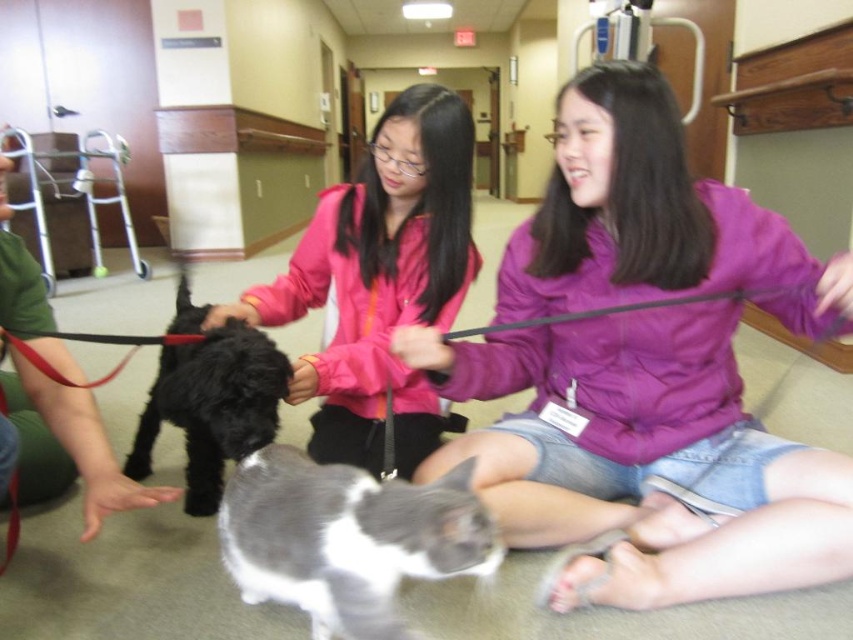
Consider the image. Who is positioned more to the right, gray-white fur cat at lower center or black matte dog at center?

Positioned to the right is gray-white fur cat at lower center.

Which of these two, gray-white fur cat at lower center or black matte dog at center, stands taller?

black matte dog at center

Where is `gray-white fur cat at lower center`? gray-white fur cat at lower center is located at coordinates (347, 538).

Which is above, purple satin jacket at center or gray-white fur cat at lower center?

purple satin jacket at center is higher up.

Does point (786, 524) lie in front of point (412, 492)?

No, (786, 524) is behind (412, 492).

Between point (796, 490) and point (306, 524), which one is positioned in front?

Positioned in front is point (306, 524).

Where is `purple satin jacket at center`? This screenshot has width=853, height=640. purple satin jacket at center is located at coordinates (641, 458).

Between matte pink jacket at center and gray-white fur cat at lower center, which one has more height?

matte pink jacket at center is taller.

You are a GUI agent. You are given a task and a screenshot of the screen. Output one action in this format:
    pyautogui.click(x=<x>, y=<y>)
    Task: Click on the matte pink jacket at center
    The width and height of the screenshot is (853, 640).
    Given the screenshot: What is the action you would take?
    pyautogui.click(x=379, y=280)